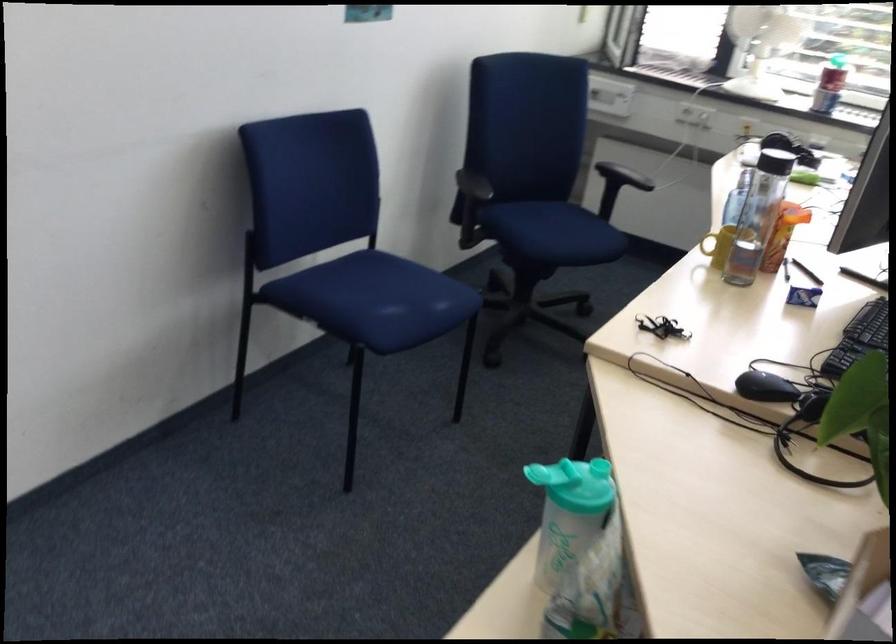
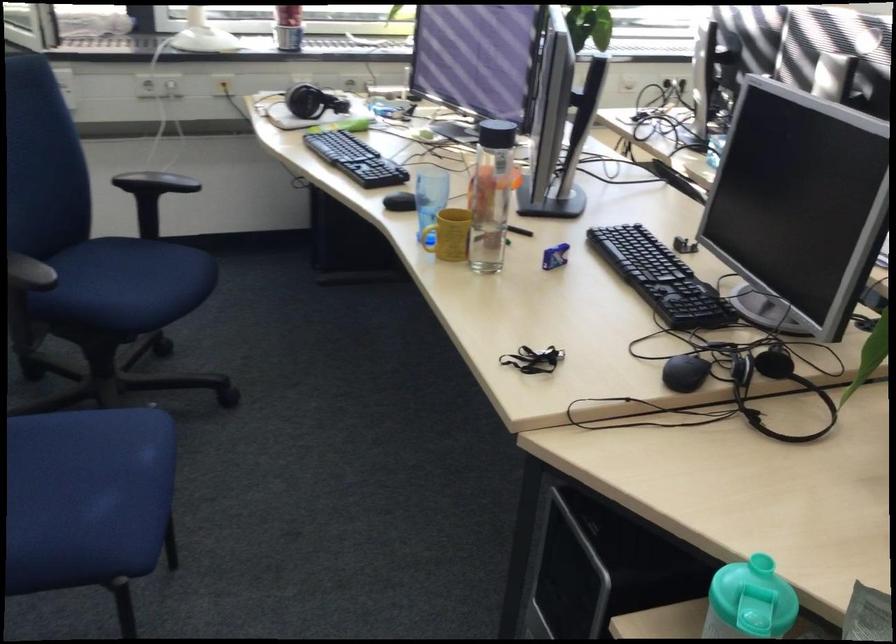
Question: The first image is from the beginning of the video and the second image is from the end. How did the camera likely rotate when shooting the video?

Choices:
 (A) Left
 (B) Right
 (C) Up
 (D) Down

Answer: (B)